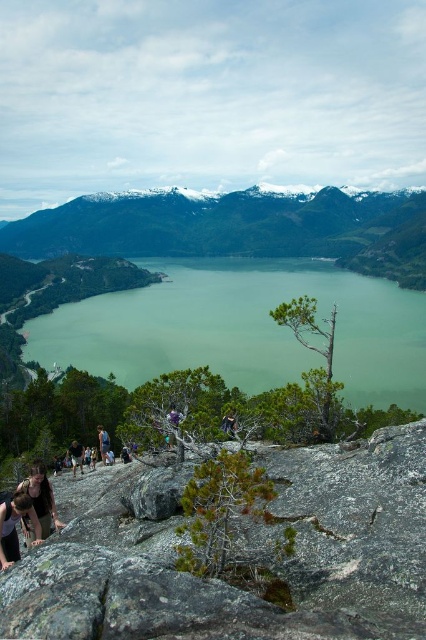
From the picture: Who is positioned more to the right, gray rough rock at lower center or dark brown leather jacket at lower left?

From the viewer's perspective, gray rough rock at lower center appears more on the right side.

Does point (28, 602) come behind point (78, 449)?

No, (28, 602) is in front of (78, 449).

Image resolution: width=426 pixels, height=640 pixels. Find the location of `gray rough rock at lower center`. gray rough rock at lower center is located at coordinates (238, 554).

Does gray rough rock at lower center have a greater width compared to dark blue shirt at center?

Indeed, gray rough rock at lower center has a greater width compared to dark blue shirt at center.

Does gray rough rock at lower center have a smaller size compared to dark blue shirt at center?

Incorrect, gray rough rock at lower center is not smaller in size than dark blue shirt at center.

Does point (255, 627) come closer to viewer compared to point (100, 429)?

Yes, it is.

Where is `gray rough rock at lower center`? This screenshot has width=426, height=640. gray rough rock at lower center is located at coordinates (238, 554).

Is point (276, 536) positioned in front of point (166, 272)?

Yes, point (276, 536) is in front of point (166, 272).

Does gray rough rock at lower center appear over greenish water at center?

No, gray rough rock at lower center is not above greenish water at center.

Describe the element at coordinates (238, 554) in the screenshot. I see `gray rough rock at lower center` at that location.

Locate an element on the screen. Image resolution: width=426 pixels, height=640 pixels. gray rough rock at lower center is located at coordinates (238, 554).